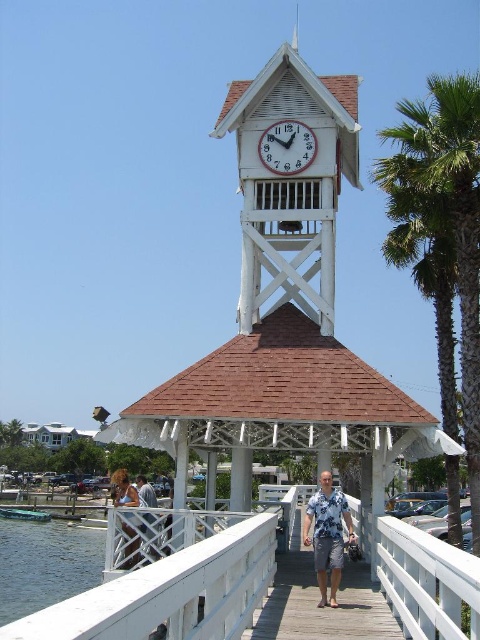
You are standing at the camera position and want to take a photo of the clock tower. The clear water at lower left is in your way. Can you step back to avoid it?

The clear water at lower left is 38.46 meters away from the camera position. Since the water is far away, stepping back a small distance won

You are standing on the wooden pier and notice the clear water at lower left and the white wooden clock at center. Which object is higher from the ground?

The clear water at lower left is taller than the white wooden clock at center, so the clear water at lower left is higher from the ground.